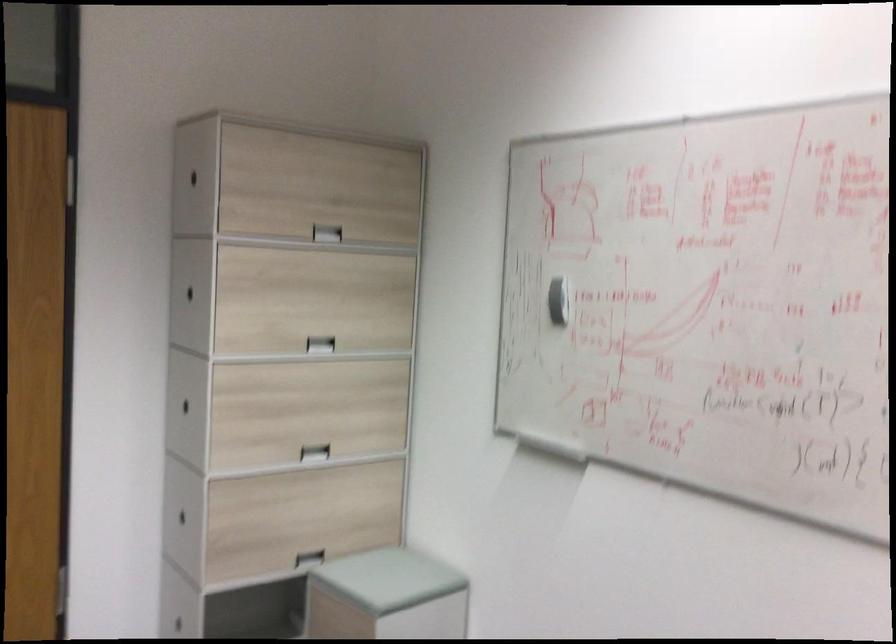
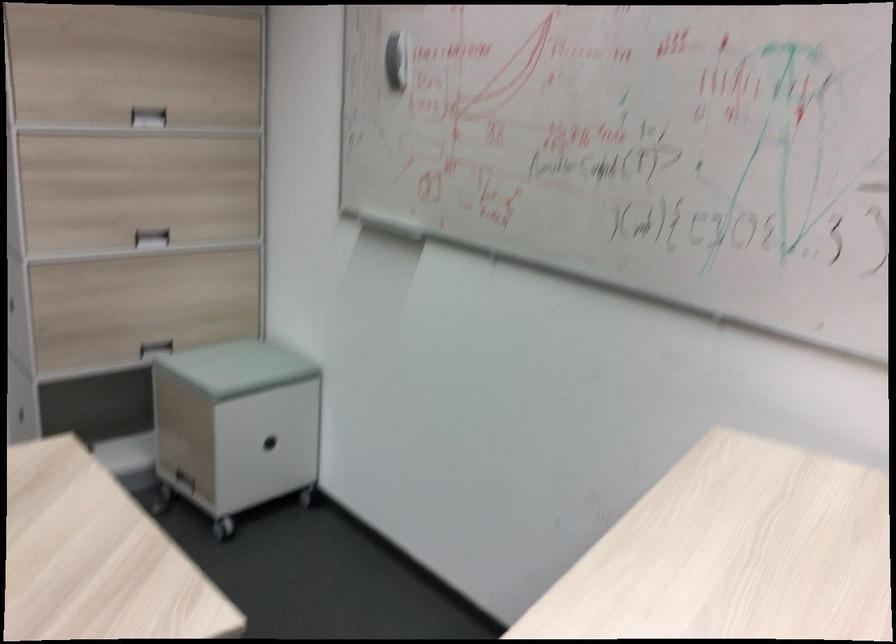
Question: Based on the continuous images, in which direction is the camera rotating? Reply with the corresponding letter.

Choices:
 (A) Left
 (B) Right
 (C) Up
 (D) Down

Answer: (D)